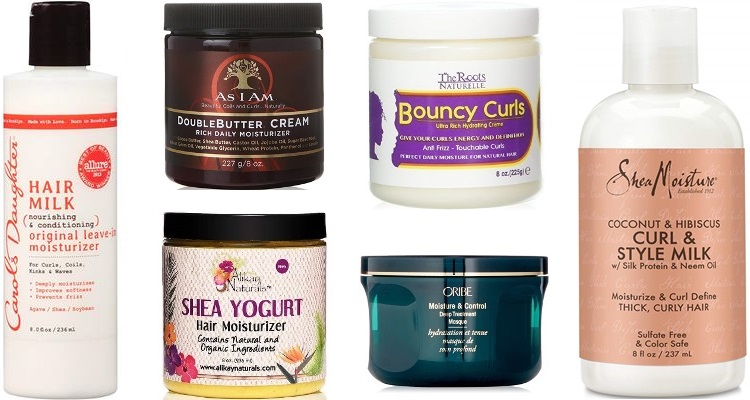
Where is `bottles/jars`? bottles/jars is located at coordinates [x=264, y=105], [x=76, y=252], [x=235, y=291], [x=495, y=322], [x=474, y=144], [x=696, y=257].